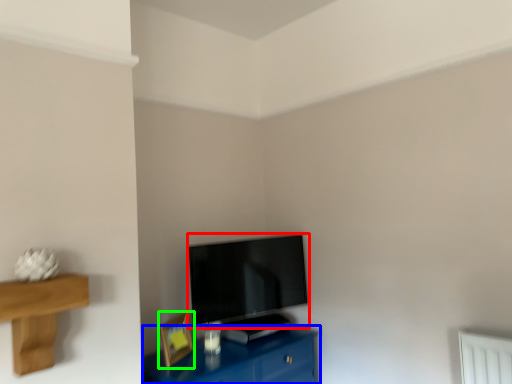
Question: Based on their relative distances, which object is nearer to television (highlighted by a red box)? Choose from table (highlighted by a blue box) and picture frame (highlighted by a green box).

Choices:
 (A) table
 (B) picture frame

Answer: (A)